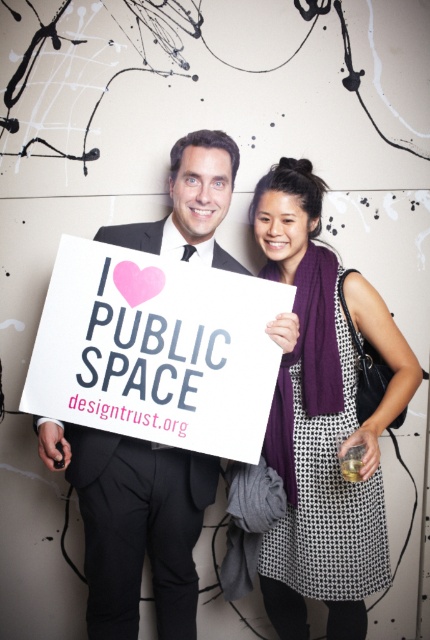
Question: Observing the image, what is the correct spatial positioning of purple knitted scarf at upper right in reference to black matte suit at center?

Choices:
 (A) above
 (B) below

Answer: (A)

Question: Which point is closer to the camera taking this photo?

Choices:
 (A) (180, 216)
 (B) (307, 545)

Answer: (A)

Question: Is purple knitted scarf at upper right smaller than white paper sign at center?

Choices:
 (A) no
 (B) yes

Answer: (A)

Question: Among these objects, which one is farthest from the camera?

Choices:
 (A) black matte suit at center
 (B) purple knitted scarf at upper right
 (C) white paper sign at center

Answer: (A)

Question: Is purple knitted scarf at upper right below white paper sign at center?

Choices:
 (A) yes
 (B) no

Answer: (A)

Question: Which point is closer to the camera?

Choices:
 (A) white paper sign at center
 (B) black matte suit at center

Answer: (A)